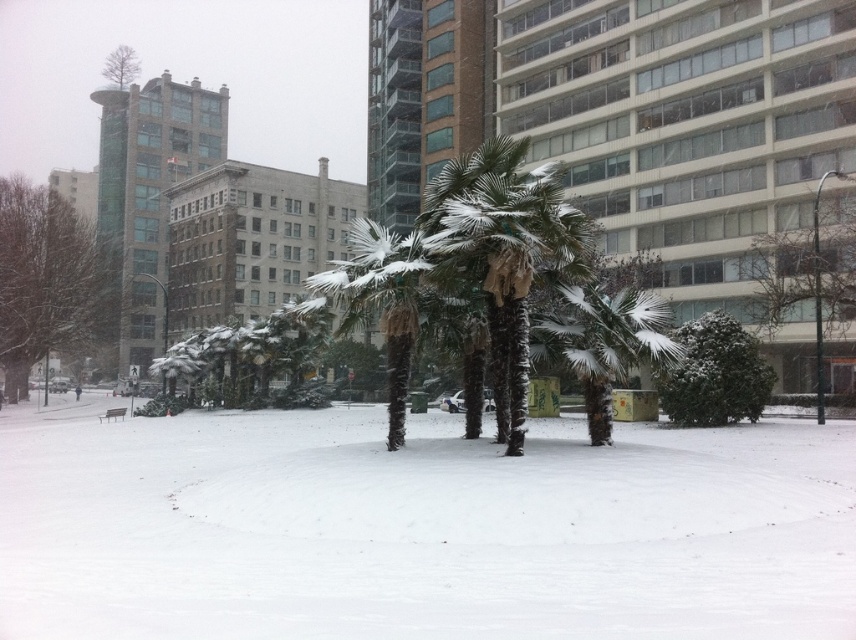
Can you confirm if green leafy tree at right is smaller than bare wood tree at upper left?

Yes.

Does point (819, 188) lie behind point (135, 76)?

That is False.

Between point (786, 273) and point (117, 54), which one is positioned behind?

Point (117, 54)

The width and height of the screenshot is (856, 640). In order to click on green leafy tree at right in this screenshot , I will do `click(811, 273)`.

Is point (375, 618) farther from camera compared to point (704, 321)?

No.

Can you confirm if white fluffy snow at center is positioned below green textured bush at center?

Yes.

Describe the element at coordinates (418, 529) in the screenshot. I see `white fluffy snow at center` at that location.

Where is `white fluffy snow at center`? white fluffy snow at center is located at coordinates (418, 529).

Which of these two, green leafy tree at left or green leafy tree at right, stands taller?

Standing taller between the two is green leafy tree at left.

Is point (7, 205) more distant than point (849, 284)?

Yes, it is.

Find the location of a particular element. The image size is (856, 640). green leafy tree at left is located at coordinates (43, 280).